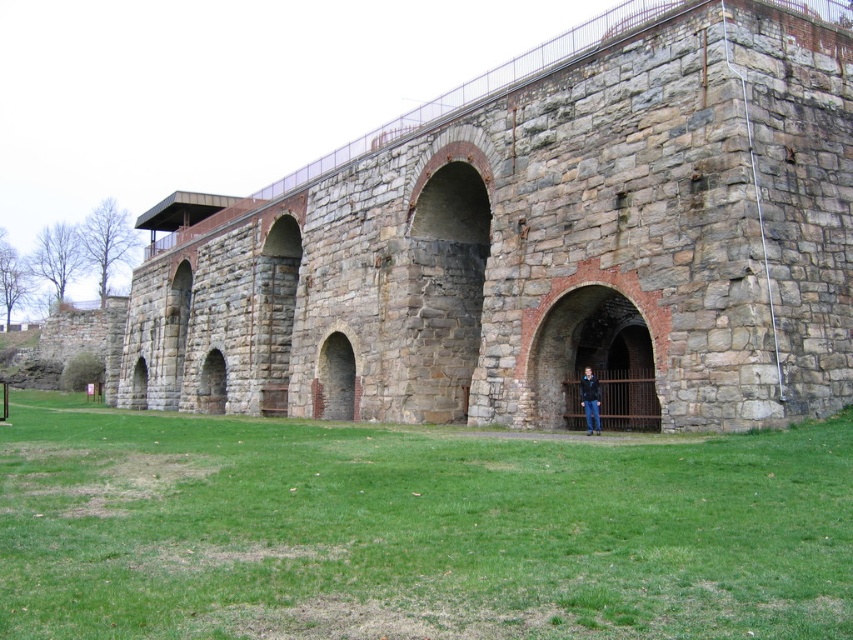
Question: Estimate the real-world distances between objects in this image. Which object is closer to the blue denim jacket at lower center?

Choices:
 (A) stone brick viaduct at center
 (B) green grass at lower center

Answer: (B)

Question: Among these points, which one is nearest to the camera?

Choices:
 (A) (583, 384)
 (B) (828, 131)

Answer: (B)

Question: From the image, what is the correct spatial relationship of stone brick viaduct at center in relation to green grass at lower center?

Choices:
 (A) below
 (B) above

Answer: (B)

Question: Does green grass at lower center appear over blue denim jacket at lower center?

Choices:
 (A) no
 (B) yes

Answer: (A)

Question: Estimate the real-world distances between objects in this image. Which object is farther from the blue denim jacket at lower center?

Choices:
 (A) stone brick viaduct at center
 (B) green grass at lower center

Answer: (A)

Question: Does green grass at lower center appear on the left side of blue denim jacket at lower center?

Choices:
 (A) no
 (B) yes

Answer: (B)